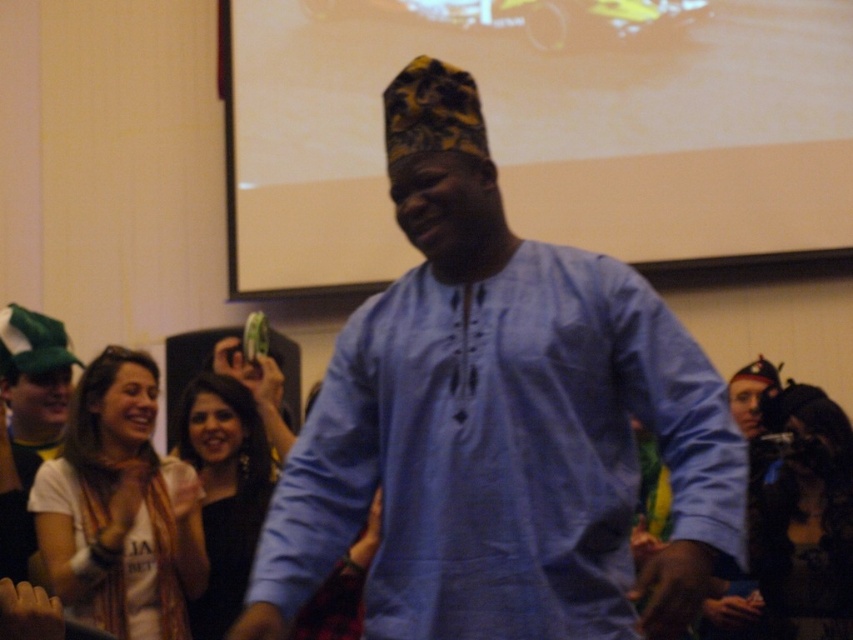
Question: Considering the real-world distances, which object is farthest from the black satin dress at center?

Choices:
 (A) white matte projection screen at upper center
 (B) white cotton scarf at left

Answer: (A)

Question: Can you confirm if white cotton scarf at left is smaller than yellow-green patterned hat at center?

Choices:
 (A) yes
 (B) no

Answer: (B)

Question: Which of the following is the closest to the observer?

Choices:
 (A) (234, 560)
 (B) (48, 324)
 (C) (711, 221)

Answer: (A)

Question: Is yellow-green patterned hat at center further to camera compared to green fabric hat at left?

Choices:
 (A) yes
 (B) no

Answer: (B)

Question: Which object appears farthest from the camera in this image?

Choices:
 (A) white matte projection screen at upper center
 (B) yellow-green patterned hat at center
 (C) white cotton scarf at left

Answer: (A)

Question: Does yellow-green patterned hat at center appear under green fabric hat at left?

Choices:
 (A) yes
 (B) no

Answer: (B)